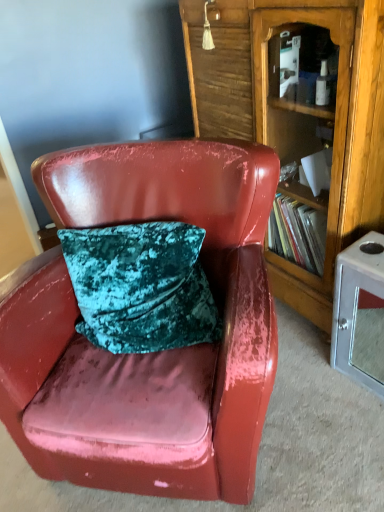
This screenshot has height=512, width=384. What do you see at coordinates (298, 118) in the screenshot?
I see `wooden bookcase at center` at bounding box center [298, 118].

Identify the location of metallic silver cabinet at lower right. (360, 312).

Is glossy leather chair at center a part of metallic silver cabinet at lower right?

No, glossy leather chair at center is not a part of metallic silver cabinet at lower right.

Does metallic silver cabinet at lower right turn towards glossy leather chair at center?

Yes, metallic silver cabinet at lower right faces towards glossy leather chair at center.

Consider the image. From the image's perspective, between metallic silver cabinet at lower right and glossy leather chair at center, which one is located above?

glossy leather chair at center appears higher in the image.

Considering the positions of point (376, 256) and point (65, 371), is point (376, 256) closer or farther from the camera than point (65, 371)?

Point (376, 256) is farther from the camera than point (65, 371).

Between metallic silver cabinet at lower right and wooden bookcase at center, which one has less height?

Standing shorter between the two is metallic silver cabinet at lower right.

Relative to wooden bookcase at center, is metallic silver cabinet at lower right in front or behind?

metallic silver cabinet at lower right is behind wooden bookcase at center.

Do you think metallic silver cabinet at lower right is within wooden bookcase at center, or outside of it?

metallic silver cabinet at lower right is outside wooden bookcase at center.

Considering the relative sizes of glossy leather chair at center and wooden bookcase at center in the image provided, is glossy leather chair at center taller than wooden bookcase at center?

Incorrect, the height of glossy leather chair at center is not larger of that of wooden bookcase at center.

In the scene shown: Is wooden bookcase at center surrounded by glossy leather chair at center?

No, glossy leather chair at center does not contain wooden bookcase at center.

Between glossy leather chair at center and wooden bookcase at center, which one has larger size?

With larger size is glossy leather chair at center.

Is glossy leather chair at center looking in the opposite direction of wooden bookcase at center?

Correct, glossy leather chair at center is looking away from wooden bookcase at center.

From the image's perspective, is wooden bookcase at center above or below glossy leather chair at center?

wooden bookcase at center is above glossy leather chair at center.

Can glossy leather chair at center be found inside wooden bookcase at center?

Definitely not — glossy leather chair at center is not inside wooden bookcase at center.

How many degrees apart are the facing directions of wooden bookcase at center and glossy leather chair at center?

The angular difference between wooden bookcase at center and glossy leather chair at center is 45.1 degrees.

Between wooden bookcase at center and glossy leather chair at center, which one appears on the left side from the viewer's perspective?

Positioned to the left is glossy leather chair at center.

Is wooden bookcase at center bigger than metallic silver cabinet at lower right?

Yes, wooden bookcase at center is bigger than metallic silver cabinet at lower right.

In the image, is wooden bookcase at center positioned in front of or behind metallic silver cabinet at lower right?

wooden bookcase at center is positioned closer to the viewer than metallic silver cabinet at lower right.

Does wooden bookcase at center have a lesser height compared to metallic silver cabinet at lower right?

In fact, wooden bookcase at center may be taller than metallic silver cabinet at lower right.

Considering the sizes of glossy leather chair at center and metallic silver cabinet at lower right in the image, is glossy leather chair at center taller or shorter than metallic silver cabinet at lower right?

In the image, glossy leather chair at center appears to be taller than metallic silver cabinet at lower right.

How far apart are glossy leather chair at center and metallic silver cabinet at lower right?

glossy leather chair at center is 23.94 inches from metallic silver cabinet at lower right.

Considering the sizes of objects glossy leather chair at center and metallic silver cabinet at lower right in the image provided, who is bigger, glossy leather chair at center or metallic silver cabinet at lower right?

glossy leather chair at center.

Is glossy leather chair at center far from metallic silver cabinet at lower right?

No, there isn't a large distance between glossy leather chair at center and metallic silver cabinet at lower right.

At what (x,y) coordinates should I click in order to perform the action: click on table beneath the glossy leather chair at center (from a real-world perspective). Please return your answer as a coordinate pair (x, y). The width and height of the screenshot is (384, 512). Looking at the image, I should click on (360, 312).

Find the location of a particular element. table behind the wooden bookcase at center is located at coordinates (360, 312).

Consider the image. Looking at the image, which one is located closer to wooden bookcase at center, metallic silver cabinet at lower right or glossy leather chair at center?

metallic silver cabinet at lower right is closer to wooden bookcase at center.

Which object lies nearer to the anchor point metallic silver cabinet at lower right, wooden bookcase at center or glossy leather chair at center?

The object closer to metallic silver cabinet at lower right is wooden bookcase at center.

Based on their spatial positions, is metallic silver cabinet at lower right or wooden bookcase at center further from glossy leather chair at center?

metallic silver cabinet at lower right is further to glossy leather chair at center.

Looking at the image, which one is located further to metallic silver cabinet at lower right, glossy leather chair at center or wooden bookcase at center?

glossy leather chair at center lies further to metallic silver cabinet at lower right than the other object.

Which object lies nearer to the anchor point glossy leather chair at center, wooden bookcase at center or metallic silver cabinet at lower right?

wooden bookcase at center is closer to glossy leather chair at center.

Based on their spatial positions, is glossy leather chair at center or metallic silver cabinet at lower right closer to wooden bookcase at center?

Among the two, metallic silver cabinet at lower right is located nearer to wooden bookcase at center.

Locate an element on the screen. bookcase situated between glossy leather chair at center and metallic silver cabinet at lower right from left to right is located at coordinates (298, 118).